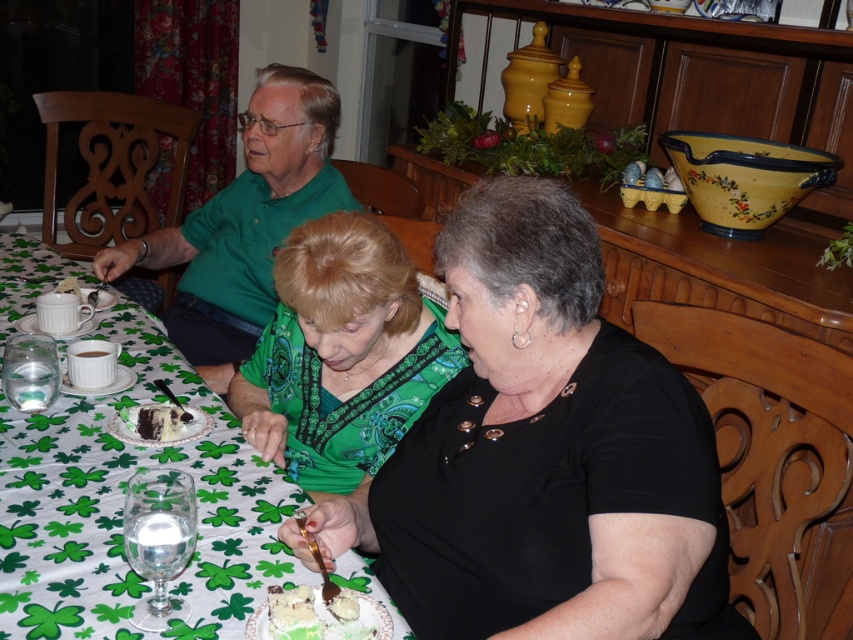
Question: Which point is closer to the camera?

Choices:
 (A) 171,440
 (B) 463,486
 (C) 91,356

Answer: (B)

Question: Which object appears closest to the camera in this image?

Choices:
 (A) black matte shirt at center
 (B) green frosted cake at lower center

Answer: (A)

Question: Is the position of green frosted cake at lower center more distant than that of chocolate cake at center?

Choices:
 (A) no
 (B) yes

Answer: (A)

Question: Can you confirm if green printed blouse at center is positioned to the right of white ceramic cup at upper left?

Choices:
 (A) yes
 (B) no

Answer: (A)

Question: Based on their relative distances, which object is nearer to the green clover-patterned tablecloth at center?

Choices:
 (A) chocolate cake at center
 (B) green frosted cake at lower center
 (C) white ceramic cup at upper left
 (D) black matte shirt at center

Answer: (A)

Question: Does green frosted cake at lower center appear under white ceramic cup at upper left?

Choices:
 (A) no
 (B) yes

Answer: (B)